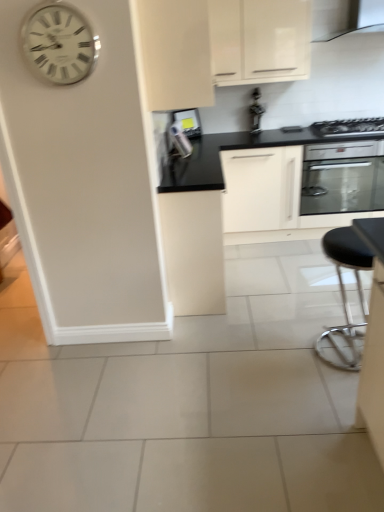
Question: From their relative heights in the image, would you say white matte cabinet at upper center, the 2th cabinetry ordered from the bottom, is taller or shorter than white glossy cabinet at upper center, the first cabinetry positioned from the top?

Choices:
 (A) tall
 (B) short

Answer: (A)

Question: Relative to white glossy cabinet at upper center, the first cabinetry positioned from the top, is white matte cabinet at upper center, the 2th cabinetry when ordered from top to bottom, in front or behind?

Choices:
 (A) behind
 (B) front

Answer: (B)

Question: Based on their relative distances, which object is nearer to the black glossy exhaust hood at upper right?

Choices:
 (A) black leather stool at lower right
 (B) white glossy cabinet at upper center, positioned as the third cabinetry in bottom-to-top order
 (C) white metallic clock at upper left
 (D) satin black oven at upper right
 (E) matte white cabinet at center, the first cabinetry positioned from the bottom

Answer: (B)

Question: Estimate the real-world distances between objects in this image. Which object is closer to the white glossy cabinet at upper center, the first cabinetry positioned from the top?

Choices:
 (A) metallic silver toaster at upper center, which is the first appliance in right-to-left order
 (B) matte white cabinet at center, arranged as the 3th cabinetry when viewed from the top
 (C) white matte cabinet at upper center, the 2th cabinetry ordered from the bottom
 (D) metallic stainless steel oven at center-right
 (E) black leather stool at lower right

Answer: (A)